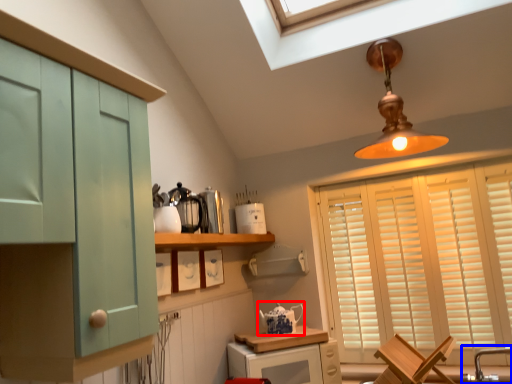
Question: Among these objects, which one is nearest to the camera, tea pot (highlighted by a red box) or faucet (highlighted by a blue box)?

Choices:
 (A) tea pot
 (B) faucet

Answer: (B)